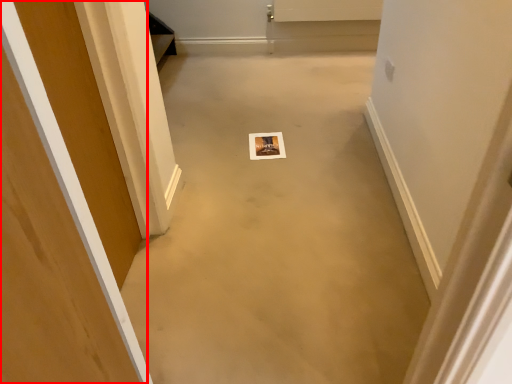
Question: From the image's perspective, where is door (annotated by the red box) located in relation to concrete in the image?

Choices:
 (A) above
 (B) below

Answer: (B)